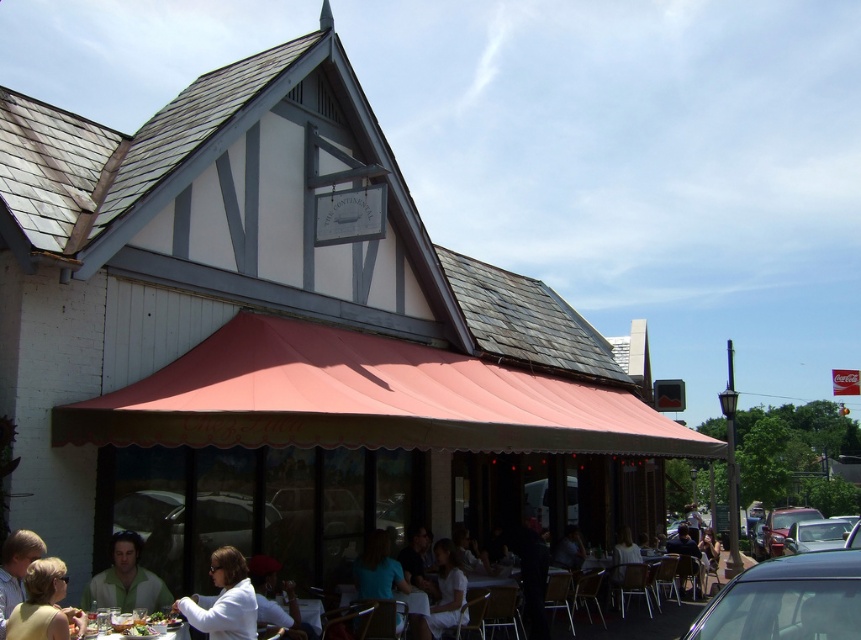
Question: Does green matte shirt at lower center appear on the left side of metallic silver car at lower right?

Choices:
 (A) no
 (B) yes

Answer: (B)

Question: Among these points, which one is nearest to the camera?

Choices:
 (A) (231, 412)
 (B) (23, 545)
 (C) (689, 634)

Answer: (C)

Question: Is teal fabric shirt at center bigger than metallic silver car at lower right?

Choices:
 (A) no
 (B) yes

Answer: (B)

Question: Which object is positioned closest to the light brown hair at lower left?

Choices:
 (A) matte pink awning at center
 (B) teal fabric shirt at center

Answer: (B)

Question: Can you confirm if metallic silver car at lower right is thinner than matte black jacket at lower right?

Choices:
 (A) yes
 (B) no

Answer: (A)

Question: Which point is closer to the camera?

Choices:
 (A) (78, 611)
 (B) (697, 573)
 (C) (773, 557)

Answer: (A)